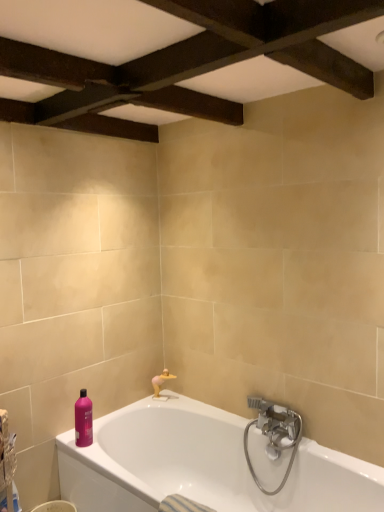
This screenshot has height=512, width=384. What do you see at coordinates (274, 434) in the screenshot?
I see `satin nickel faucet at lower right` at bounding box center [274, 434].

Measure the distance between matte gold faucet at lower center and camera.

The depth of matte gold faucet at lower center is 8.21 feet.

This screenshot has height=512, width=384. What are the coordinates of `matte gold faucet at lower center` in the screenshot? It's located at (160, 382).

The height and width of the screenshot is (512, 384). What do you see at coordinates (83, 420) in the screenshot?
I see `pink glossy bottle at lower left` at bounding box center [83, 420].

This screenshot has width=384, height=512. What do you see at coordinates (201, 465) in the screenshot? I see `white glossy bathtub at lower center` at bounding box center [201, 465].

Locate an element on the screen. The width and height of the screenshot is (384, 512). white glossy bathtub at lower center is located at coordinates (201, 465).

Identify the location of satin nickel faucet at lower right. (274, 434).

Considering the sizes of plastic woven basket at lower left and matte gold faucet at lower center in the image, is plastic woven basket at lower left taller or shorter than matte gold faucet at lower center?

Considering their sizes, plastic woven basket at lower left has less height than matte gold faucet at lower center.

Which point is more forward, (12, 445) or (160, 383)?

Point (12, 445)

From the image's perspective, which is above, plastic woven basket at lower left or matte gold faucet at lower center?

matte gold faucet at lower center, from the image's perspective.

Can you confirm if plastic woven basket at lower left is thinner than matte gold faucet at lower center?

No.

Which is closer to the camera, (285, 508) or (15, 457)?

Point (285, 508) is farther from the camera than point (15, 457).

Based on their sizes in the image, would you say white glossy bathtub at lower center is bigger or smaller than plastic woven basket at lower left?

Clearly, white glossy bathtub at lower center is larger in size than plastic woven basket at lower left.

This screenshot has width=384, height=512. I want to click on bathtub that is in front of the plastic woven basket at lower left, so click(x=201, y=465).

Where is `basket above the satin nickel faucet at lower right (from the image's perspective)`? The image size is (384, 512). basket above the satin nickel faucet at lower right (from the image's perspective) is located at coordinates (7, 461).

Which is behind, point (7, 486) or point (284, 420)?

Positioned behind is point (284, 420).

Are plastic woven basket at lower left and satin nickel faucet at lower right located far from each other?

That's right, there is a large distance between plastic woven basket at lower left and satin nickel faucet at lower right.

Looking at their sizes, would you say plastic woven basket at lower left is wider or thinner than satin nickel faucet at lower right?

plastic woven basket at lower left is thinner than satin nickel faucet at lower right.

Is white glossy bathtub at lower center positioned with its back to satin nickel faucet at lower right?

Yes, white glossy bathtub at lower center's orientation is away from satin nickel faucet at lower right.

Considering the positions of points (76, 466) and (273, 417), is point (76, 466) farther from camera compared to point (273, 417)?

That is False.

Which object is further away from the camera, white glossy bathtub at lower center or satin nickel faucet at lower right?

satin nickel faucet at lower right is further from the camera.

Which object is thinner, satin nickel faucet at lower right or pink glossy bottle at lower left?

With smaller width is pink glossy bottle at lower left.

Which is in front, point (274, 449) or point (91, 426)?

The point (274, 449) is closer.

Does satin nickel faucet at lower right have a lesser height compared to pink glossy bottle at lower left?

No.

Where is `tap on the right side of pink glossy bottle at lower left`? The height and width of the screenshot is (512, 384). tap on the right side of pink glossy bottle at lower left is located at coordinates (274, 434).

From a real-world perspective, which object rests below the other?

matte gold faucet at lower center, from a real-world perspective.

Considering the positions of points (165, 374) and (13, 464), is point (165, 374) farther from camera compared to point (13, 464)?

Yes, point (165, 374) is farther from viewer.

Between matte gold faucet at lower center and plastic woven basket at lower left, which one has larger size?

With larger size is plastic woven basket at lower left.

Considering the sizes of objects matte gold faucet at lower center and plastic woven basket at lower left in the image provided, who is wider, matte gold faucet at lower center or plastic woven basket at lower left?

plastic woven basket at lower left.

From the image's perspective, who appears lower, white glossy bathtub at lower center or pink glossy bottle at lower left?

white glossy bathtub at lower center, from the image's perspective.

Looking at this image, is pink glossy bottle at lower left completely or partially inside white glossy bathtub at lower center?

No, pink glossy bottle at lower left is not surrounded by white glossy bathtub at lower center.

Can you tell me how much white glossy bathtub at lower center and pink glossy bottle at lower left differ in facing direction?

They differ by 1.95 degrees in their facing directions.

I want to click on toiletry lying on the left of white glossy bathtub at lower center, so click(x=83, y=420).

What are the coordinates of `basket that appears above the matte gold faucet at lower center (from a real-world perspective)` in the screenshot? It's located at [7, 461].

You are a GUI agent. You are given a task and a screenshot of the screen. Output one action in this format:
    pyautogui.click(x=<x>, y=<y>)
    Task: Click on the basket behind the white glossy bathtub at lower center
    The width and height of the screenshot is (384, 512).
    Given the screenshot: What is the action you would take?
    pyautogui.click(x=7, y=461)

When comparing their distances from pink glossy bottle at lower left, does matte gold faucet at lower center or plastic woven basket at lower left seem further?

The object further to pink glossy bottle at lower left is matte gold faucet at lower center.

Considering their positions, is white glossy bathtub at lower center positioned further to satin nickel faucet at lower right than pink glossy bottle at lower left?

The object further to satin nickel faucet at lower right is pink glossy bottle at lower left.

Estimate the real-world distances between objects in this image. Which object is closer to plastic woven basket at lower left, white glossy bathtub at lower center or pink glossy bottle at lower left?

pink glossy bottle at lower left is positioned closer to the anchor plastic woven basket at lower left.

From the image, which object appears to be farther from pink glossy bottle at lower left, white glossy bathtub at lower center or satin nickel faucet at lower right?

satin nickel faucet at lower right is further to pink glossy bottle at lower left.

From the image, which object appears to be nearer to plastic woven basket at lower left, pink glossy bottle at lower left or white glossy bathtub at lower center?

Among the two, pink glossy bottle at lower left is located nearer to plastic woven basket at lower left.

When comparing their distances from pink glossy bottle at lower left, does satin nickel faucet at lower right or matte gold faucet at lower center seem further?

Based on the image, satin nickel faucet at lower right appears to be further to pink glossy bottle at lower left.

Estimate the real-world distances between objects in this image. Which object is further from plastic woven basket at lower left, pink glossy bottle at lower left or satin nickel faucet at lower right?

satin nickel faucet at lower right is positioned further to the anchor plastic woven basket at lower left.

Which object lies nearer to the anchor point white glossy bathtub at lower center, matte gold faucet at lower center or pink glossy bottle at lower left?

Based on the image, pink glossy bottle at lower left appears to be nearer to white glossy bathtub at lower center.

Where is `basket between white glossy bathtub at lower center and matte gold faucet at lower center from front to back`? basket between white glossy bathtub at lower center and matte gold faucet at lower center from front to back is located at coordinates coord(7,461).

This screenshot has height=512, width=384. Find the location of `tap positioned between white glossy bathtub at lower center and matte gold faucet at lower center from near to far`. tap positioned between white glossy bathtub at lower center and matte gold faucet at lower center from near to far is located at coordinates (274, 434).

The width and height of the screenshot is (384, 512). Find the location of `toiletry located between plastic woven basket at lower left and matte gold faucet at lower center in the depth direction`. toiletry located between plastic woven basket at lower left and matte gold faucet at lower center in the depth direction is located at coordinates (83, 420).

I want to click on bathtub situated between pink glossy bottle at lower left and satin nickel faucet at lower right from left to right, so click(x=201, y=465).